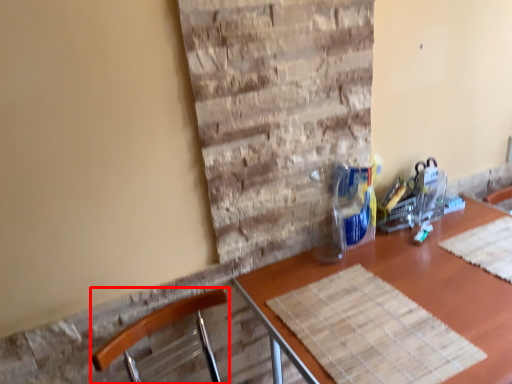
Question: Observing the image, what is the correct spatial positioning of chair (annotated by the red box) in reference to table?

Choices:
 (A) left
 (B) right

Answer: (A)